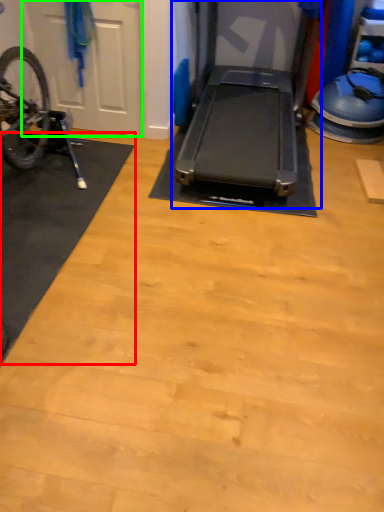
Question: Which is farther away from mat (highlighted by a red box)? treadmill (highlighted by a blue box) or garage door (highlighted by a green box)?

Choices:
 (A) treadmill
 (B) garage door

Answer: (A)